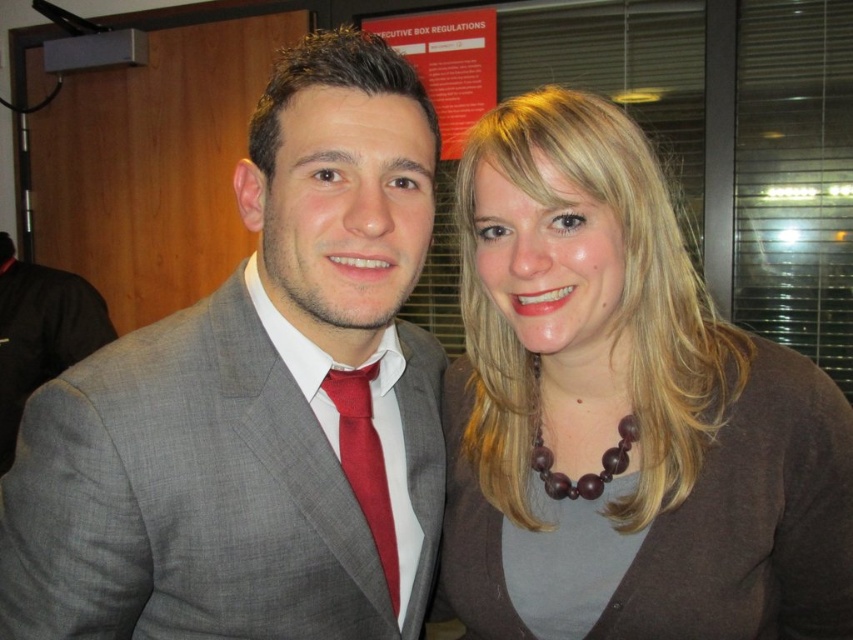
Question: Does matte gray suit at center have a larger size compared to matte gray suit at left?

Choices:
 (A) no
 (B) yes

Answer: (B)

Question: Which of the following is the farthest from the observer?

Choices:
 (A) (79, 304)
 (B) (595, 376)
 (C) (386, 492)
 (D) (230, 620)

Answer: (A)

Question: Which object appears farthest from the camera in this image?

Choices:
 (A) matte red tie at center
 (B) matte gray suit at left
 (C) matte gray suit at center

Answer: (B)

Question: Is the position of brown matte necklace at upper right more distant than that of matte red tie at center?

Choices:
 (A) no
 (B) yes

Answer: (A)

Question: From the image, what is the correct spatial relationship of brown matte necklace at upper right in relation to matte red tie at center?

Choices:
 (A) above
 (B) below

Answer: (A)

Question: Among these points, which one is nearest to the camera?

Choices:
 (A) (631, 259)
 (B) (360, 500)

Answer: (B)